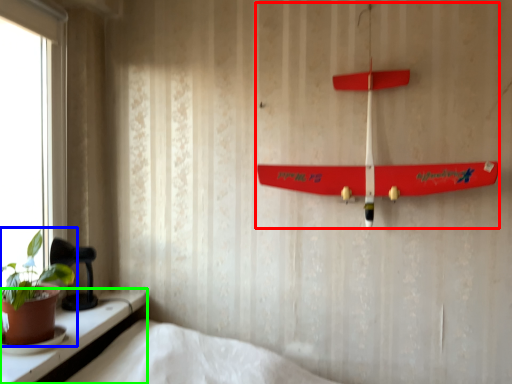
Question: Which is nearer to the toy (highlighted by a red box)? houseplant (highlighted by a blue box) or window (highlighted by a green box).

Choices:
 (A) houseplant
 (B) window

Answer: (B)